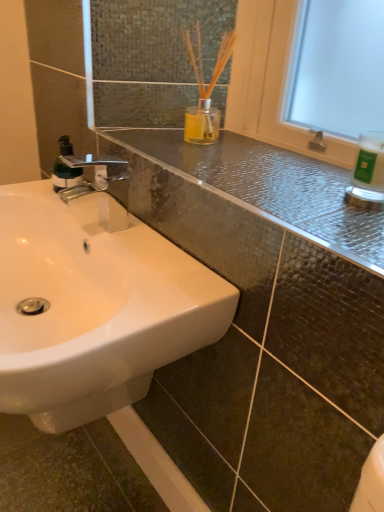
Question: Are white glossy sink at lower left and white glossy bottle at upper right beside each other?

Choices:
 (A) yes
 (B) no

Answer: (B)

Question: Considering the relative positions of white glossy sink at lower left and white glossy bottle at upper right in the image provided, is white glossy sink at lower left to the left of white glossy bottle at upper right from the viewer's perspective?

Choices:
 (A) yes
 (B) no

Answer: (A)

Question: Is white glossy sink at lower left looking in the opposite direction of white glossy bottle at upper right?

Choices:
 (A) yes
 (B) no

Answer: (B)

Question: Would you say white glossy sink at lower left is outside white glossy bottle at upper right?

Choices:
 (A) yes
 (B) no

Answer: (A)

Question: Considering the relative sizes of white glossy sink at lower left and white glossy bottle at upper right in the image provided, is white glossy sink at lower left taller than white glossy bottle at upper right?

Choices:
 (A) no
 (B) yes

Answer: (B)

Question: Considering the positions of white glossy sink at lower left and white glossy bottle at upper right in the image, is white glossy sink at lower left bigger or smaller than white glossy bottle at upper right?

Choices:
 (A) small
 (B) big

Answer: (B)

Question: Do you think white glossy sink at lower left is within white glossy bottle at upper right, or outside of it?

Choices:
 (A) outside
 (B) inside

Answer: (A)

Question: Considering the positions of white glossy sink at lower left and white glossy bottle at upper right in the image, is white glossy sink at lower left wider or thinner than white glossy bottle at upper right?

Choices:
 (A) wide
 (B) thin

Answer: (A)

Question: Visually, is white glossy sink at lower left positioned to the left or to the right of white glossy bottle at upper right?

Choices:
 (A) right
 (B) left

Answer: (B)

Question: Considering the positions of point (66, 179) and point (36, 185), is point (66, 179) closer or farther from the camera than point (36, 185)?

Choices:
 (A) farther
 (B) closer

Answer: (A)

Question: Considering their positions, is green matte bottle at left located in front of or behind white glossy sink at lower left?

Choices:
 (A) front
 (B) behind

Answer: (B)

Question: From a real-world perspective, is green matte bottle at left above or below white glossy sink at lower left?

Choices:
 (A) above
 (B) below

Answer: (A)

Question: In terms of width, does green matte bottle at left look wider or thinner when compared to white glossy sink at lower left?

Choices:
 (A) wide
 (B) thin

Answer: (B)

Question: Considering their positions, is green matte bottle at left located in front of or behind white glossy bottle at upper right?

Choices:
 (A) behind
 (B) front

Answer: (A)

Question: Considering the positions of green matte bottle at left and white glossy bottle at upper right in the image, is green matte bottle at left bigger or smaller than white glossy bottle at upper right?

Choices:
 (A) big
 (B) small

Answer: (A)